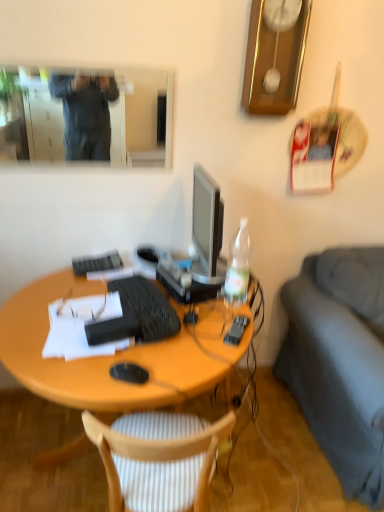
What are the coordinates of `vacant area that is in front of black matte keyboard at center, positioned as the first computer keyboard in left-to-right order` in the screenshot? It's located at (81, 284).